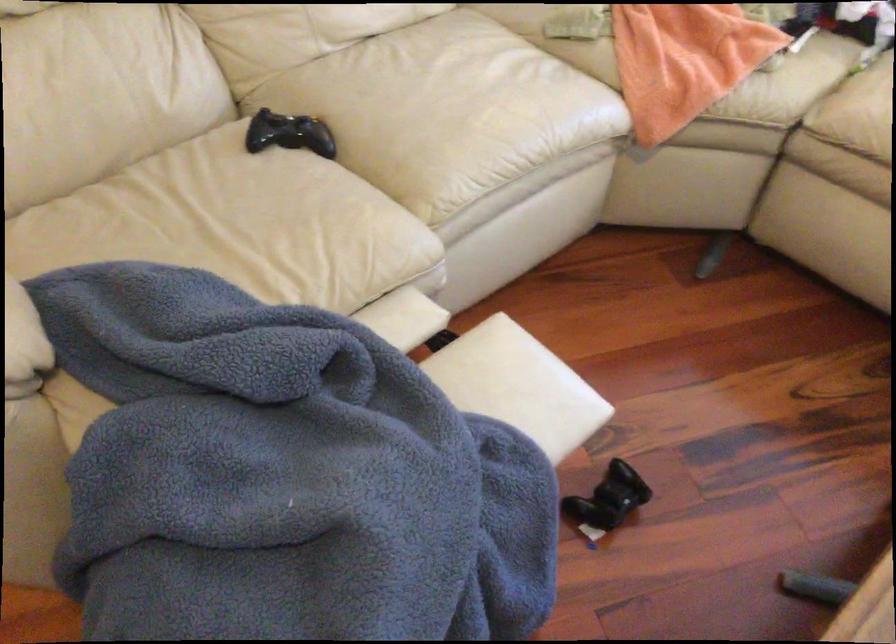
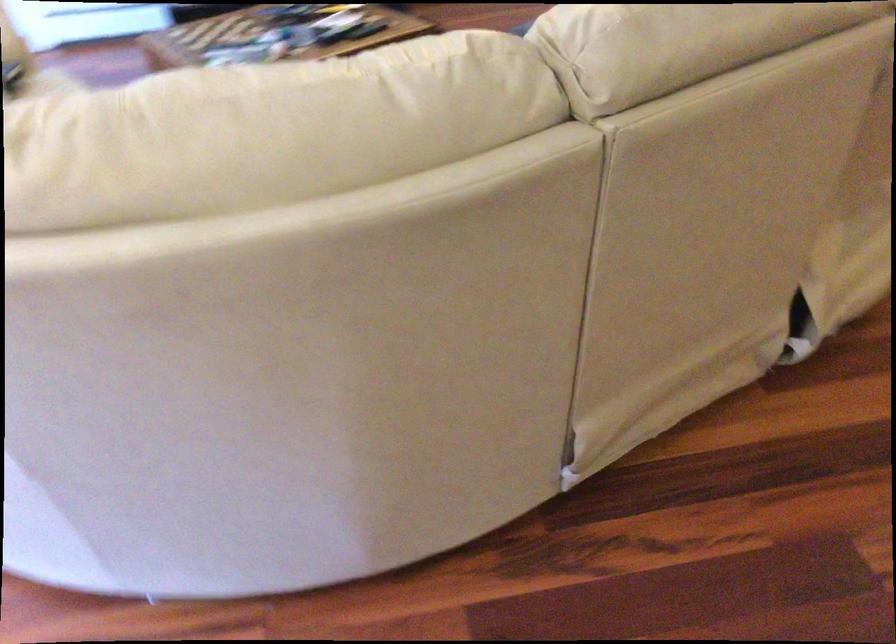
Question: I am providing you with two images of the same scene from different viewpoints. Please identify which objects are invisible in image2.

Choices:
 (A) sofa armrest
 (B) black game controller
 (C) black glove
 (D) sofa sitting surface

Answer: (B)